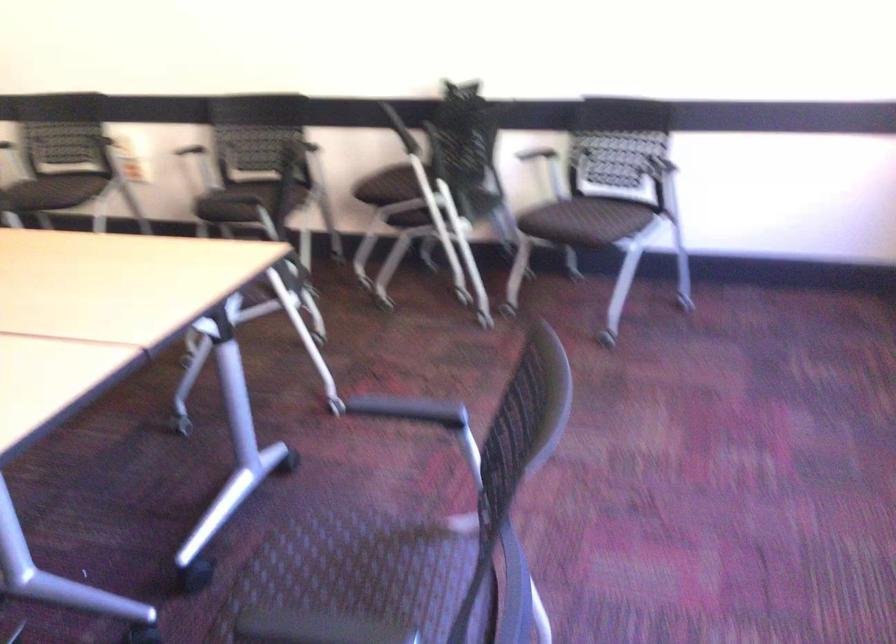
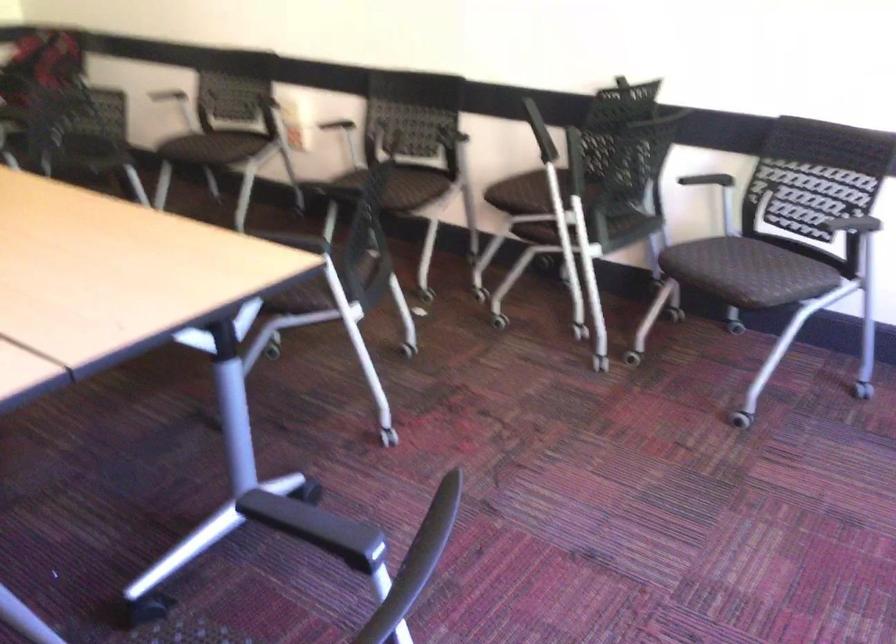
Where in the second image is the point corresponding to [540,146] from the first image?

(718, 169)